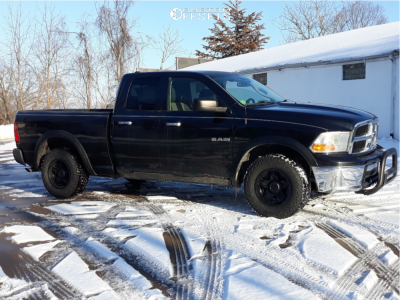
At what (x,y) coordinates should I click in order to perform the action: click on building window. Please return your answer as a coordinate pair (x, y). This screenshot has height=300, width=400. Looking at the image, I should click on (361, 73), (269, 81).